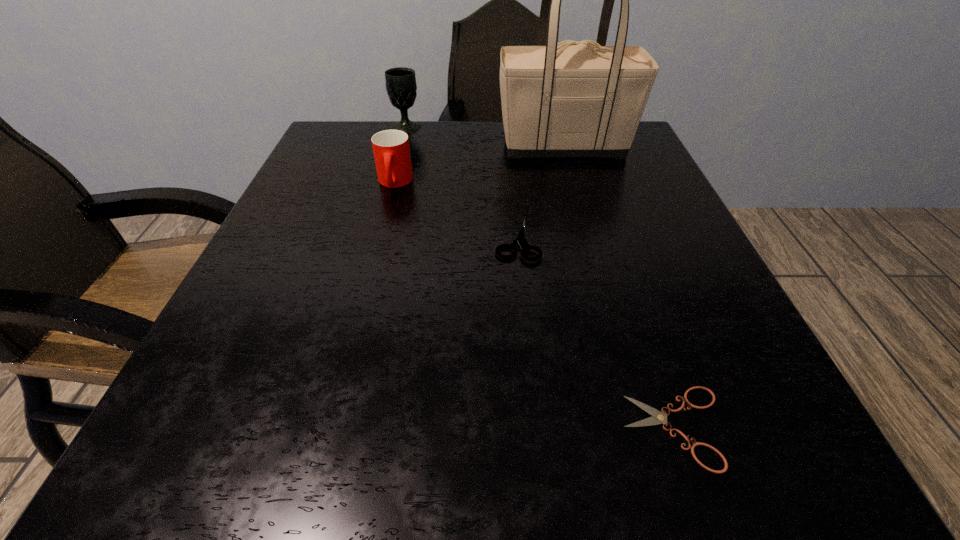
Find the location of a particular element. This screenshot has width=960, height=540. free point between the nearest object and the second nearest object is located at coordinates (596, 334).

The width and height of the screenshot is (960, 540). What are the coordinates of `the third closest object to the third shortest object` in the screenshot? It's located at (521, 241).

Locate which object is the second closest to the fourth shortest object. Please provide its 2D coordinates. Your answer should be formatted as a tuple, i.e. [(x, y)], where the tuple contains the x and y coordinates of a point satisfying the conditions above.

[(579, 99)]

Identify the location of vacant region that satisfies the following two spatial constraints: 1. on the back side of the nearer shears; 2. with handles facing forward on the shopping bag. (581, 146).

Locate an element on the screen. Image resolution: width=960 pixels, height=540 pixels. free space that satisfies the following two spatial constraints: 1. with handles facing forward on the tallest object; 2. on the side of the third tallest object with the handle is located at coordinates click(574, 183).

Locate an element on the screen. vacant space that satisfies the following two spatial constraints: 1. with handles facing forward on the nearest object; 2. on the left side of the tallest object is located at coordinates (644, 428).

At what (x,y) coordinates should I click in order to perform the action: click on blank area in the image that satisfies the following two spatial constraints: 1. on the back side of the nearest object; 2. with handles facing forward on the tallest object. Please return your answer as a coordinate pair (x, y). Looking at the image, I should click on pos(581,146).

You are a GUI agent. You are given a task and a screenshot of the screen. Output one action in this format:
    pyautogui.click(x=<x>, y=<y>)
    Task: Click on the vacant space that satisfies the following two spatial constraints: 1. on the front side of the farther shears; 2. on the right side of the chalice
    The width and height of the screenshot is (960, 540).
    Given the screenshot: What is the action you would take?
    pyautogui.click(x=375, y=241)